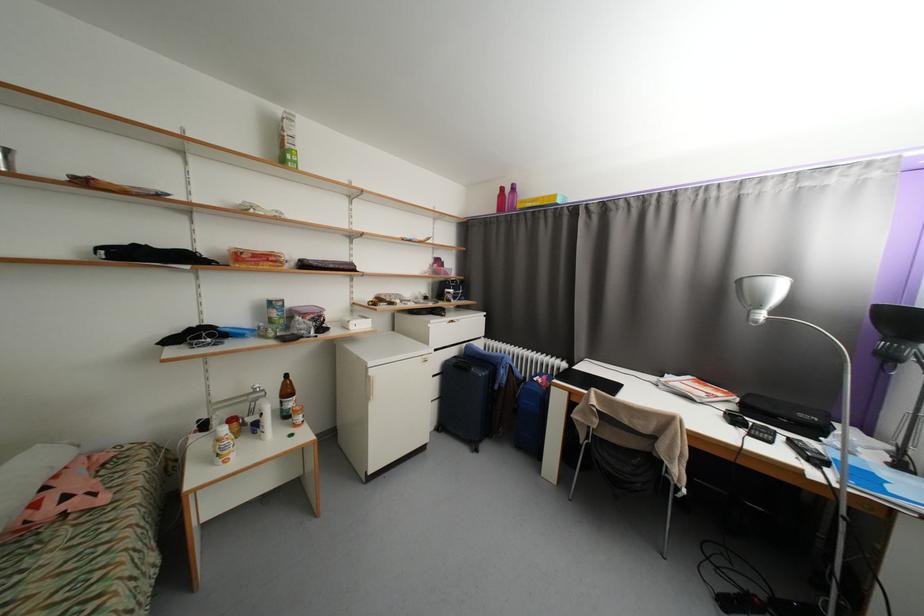
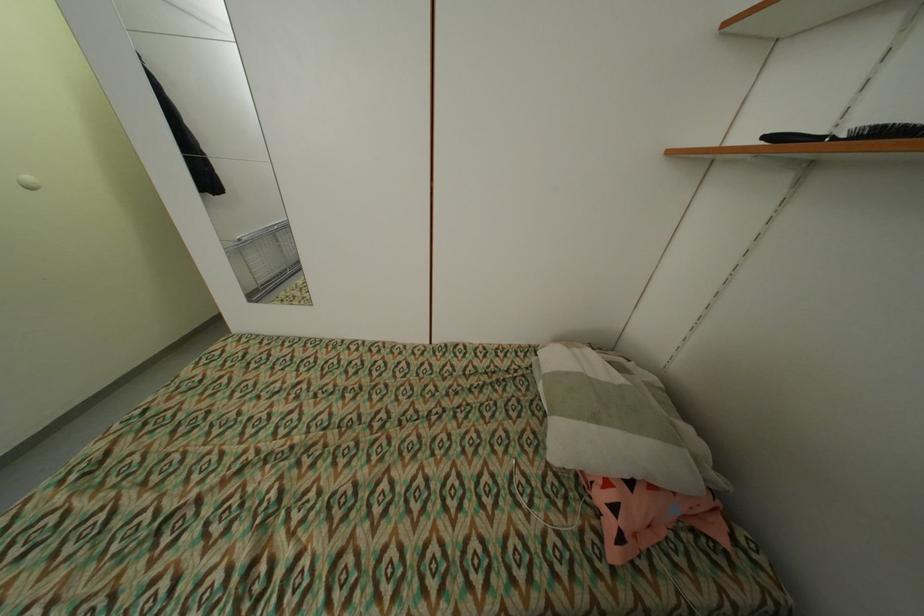
In the second image, find the point that corresponds to pixel 54 513 in the first image.

(606, 498)